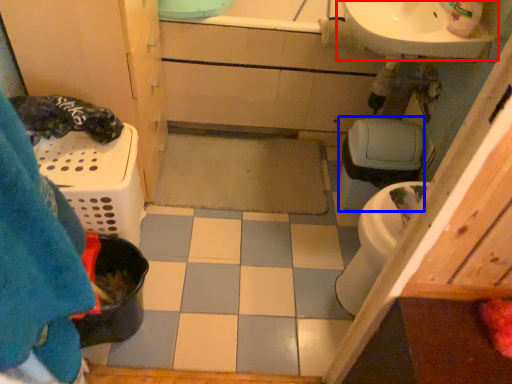
Question: Which object is closer to the camera taking this photo, sink (highlighted by a red box) or toilet bowl (highlighted by a blue box)?

Choices:
 (A) sink
 (B) toilet bowl

Answer: (A)